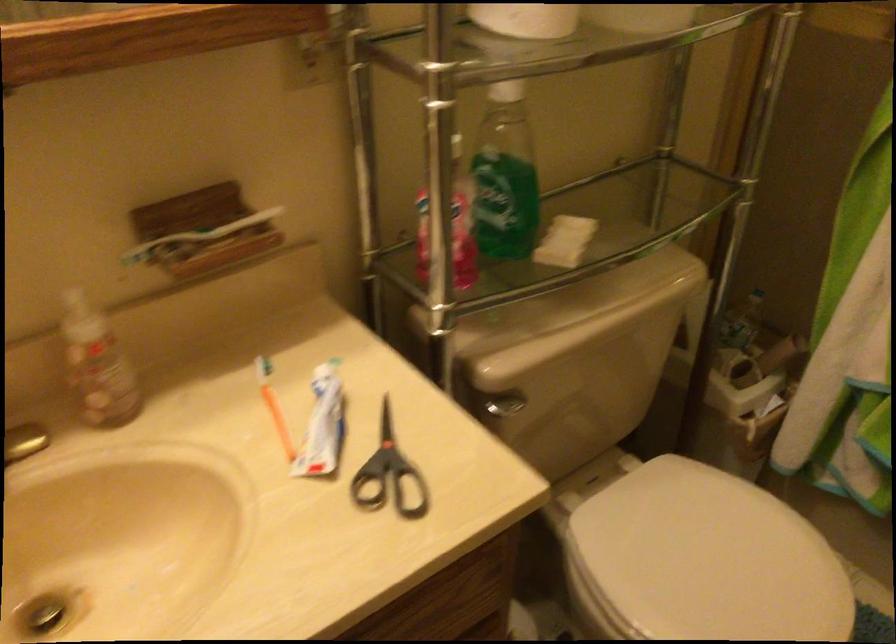
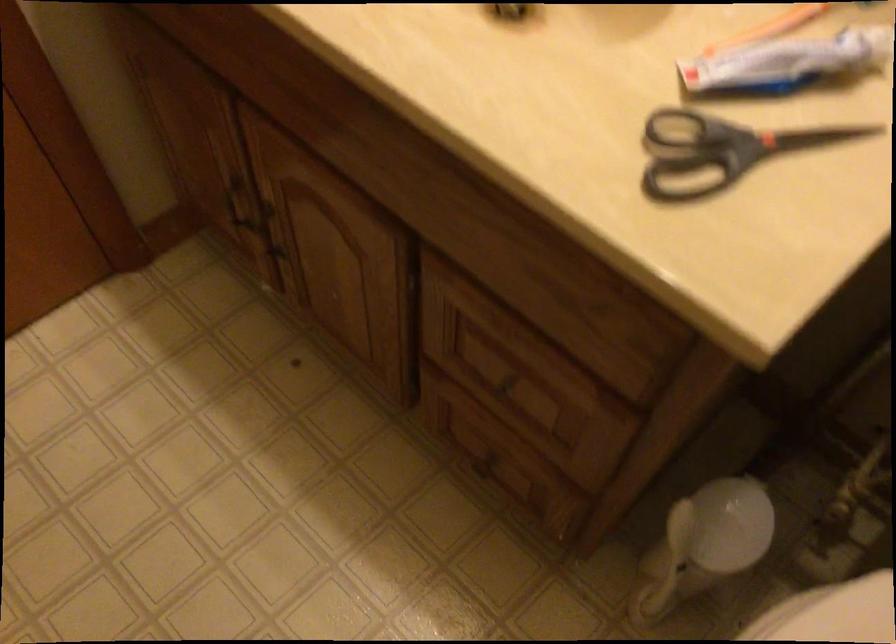
How did the camera likely rotate?

The camera rotated toward left-down.